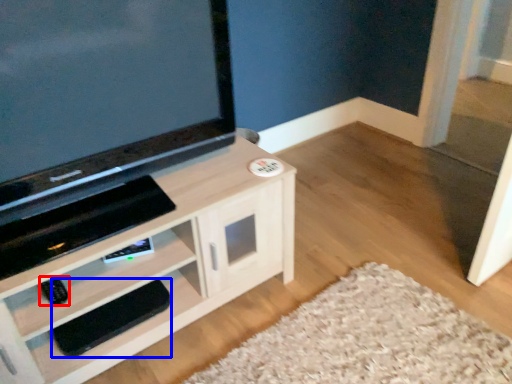
Question: Which point is further to the camera, remote (highlighted by a red box) or footrest (highlighted by a blue box)?

Choices:
 (A) remote
 (B) footrest

Answer: (B)